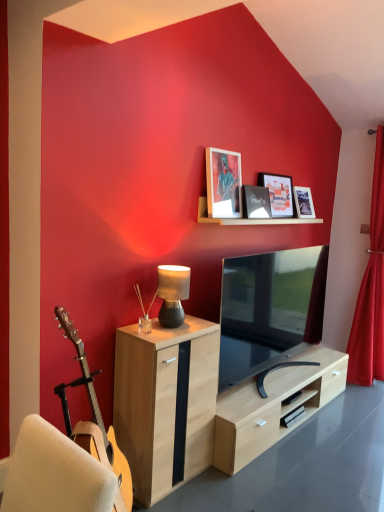
What are the coordinates of `vacant space underneath matte black lamp at center (from a real-world perspective)` in the screenshot? It's located at (180, 324).